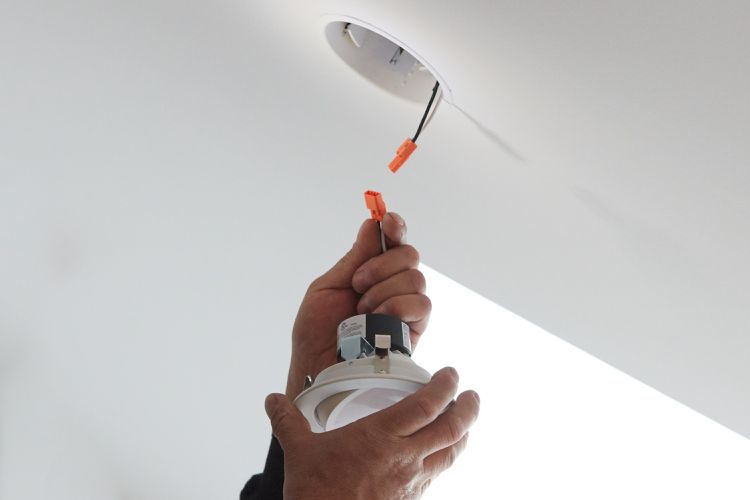
Locate an element on the screen. white cord is located at coordinates (427, 123).